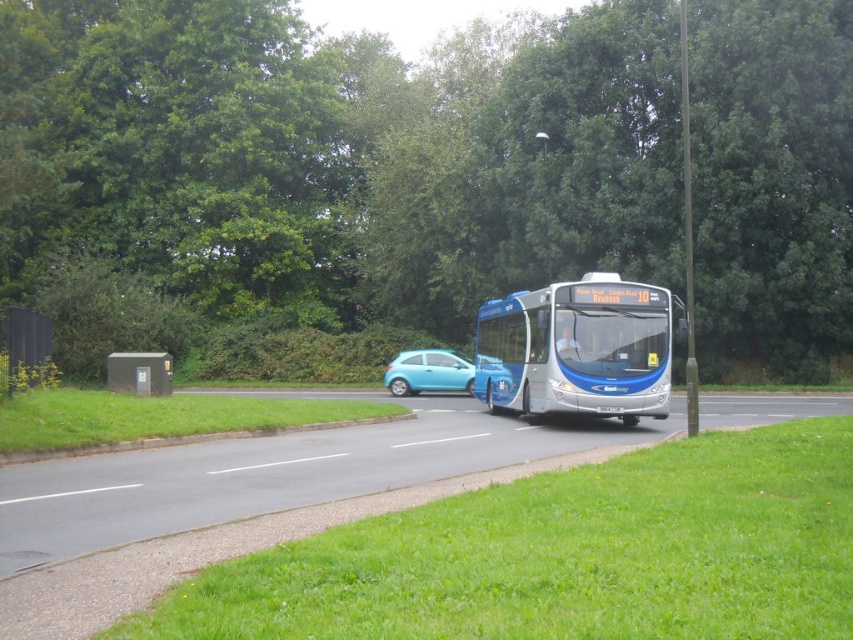
Locate an element on the screen. blue metallic bus at center is located at coordinates (576, 349).

Is point (610, 385) positioned after point (154, 372)?

No, (610, 385) is closer to viewer.

The image size is (853, 640). Find the location of `blue metallic bus at center`. blue metallic bus at center is located at coordinates pos(576,349).

Between point (456, 387) and point (163, 356), which one is positioned in front?

Point (163, 356)

Is point (457, 376) positioned before point (128, 369)?

No, it is not.

Locate an element on the screen. Image resolution: width=853 pixels, height=640 pixels. light blue glossy hatchback at center is located at coordinates (428, 371).

Is point (653, 376) farther from camera compared to point (456, 388)?

No, it is not.

Is blue metallic bus at center shorter than light blue glossy hatchback at center?

Incorrect, blue metallic bus at center's height does not fall short of light blue glossy hatchback at center's.

At what (x,y) coordinates should I click in order to perform the action: click on blue metallic bus at center. Please return your answer as a coordinate pair (x, y). Image resolution: width=853 pixels, height=640 pixels. Looking at the image, I should click on (576, 349).